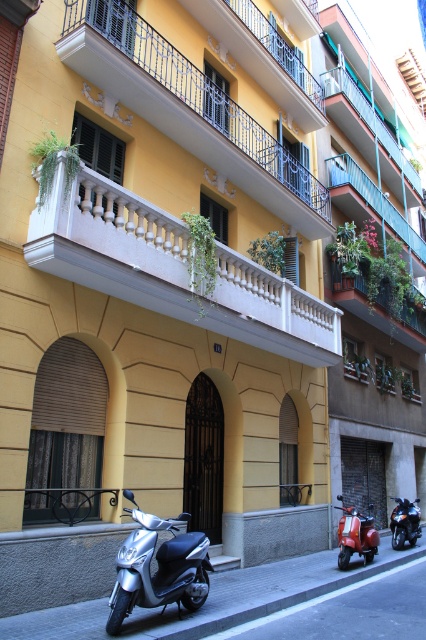
Question: Which point is closer to the camera taking this photo?

Choices:
 (A) (423, 548)
 (B) (411, 182)
 (C) (270, 291)
 (D) (351, 173)

Answer: (C)

Question: Which point is closer to the camera?

Choices:
 (A) (389, 618)
 (B) (414, 262)

Answer: (A)

Question: Does silver metallic scooter at lower left have a lesser width compared to blue metal balcony at upper center?

Choices:
 (A) yes
 (B) no

Answer: (B)

Question: Which object is the farthest from the shiny red scooter at lower right?

Choices:
 (A) yellow painted wood balcony at upper center
 (B) blue metal balcony at upper center
 (C) smooth concrete curb at lower center

Answer: (B)

Question: Is smooth concrete curb at lower center thinner than shiny red scooter at lower right?

Choices:
 (A) yes
 (B) no

Answer: (A)

Question: Is yellow painted wood balcony at upper center positioned in front of shiny red scooter at lower right?

Choices:
 (A) no
 (B) yes

Answer: (B)